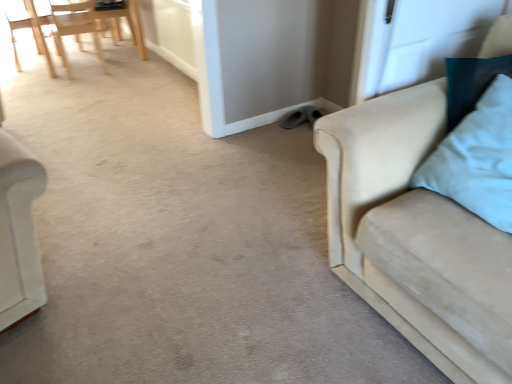
Question: Is white glossy screen door at upper right inside the boundaries of gray suede shoes at center, or outside?

Choices:
 (A) inside
 (B) outside

Answer: (B)

Question: Looking at the image, does white glossy screen door at upper right seem bigger or smaller compared to gray suede shoes at center?

Choices:
 (A) big
 (B) small

Answer: (A)

Question: Estimate the real-world distances between objects in this image. Which object is farther from the gray suede shoes at center?

Choices:
 (A) light blue fabric pillow at right
 (B) light wood chair at upper left, arranged as the second chair when viewed from the left
 (C) suede beige couch at right
 (D) light wood chair at upper left, the third chair viewed from the right
 (E) light wood chair at upper left, the third chair positioned from the left

Answer: (D)

Question: Considering the real-world distances, which object is farthest from the light wood chair at upper left, the third chair positioned from the left?

Choices:
 (A) white glossy screen door at upper right
 (B) light wood chair at upper left, arranged as the second chair when viewed from the left
 (C) suede beige couch at right
 (D) light wood chair at upper left, arranged as the first chair when viewed from the left
 (E) light blue fabric pillow at right

Answer: (E)